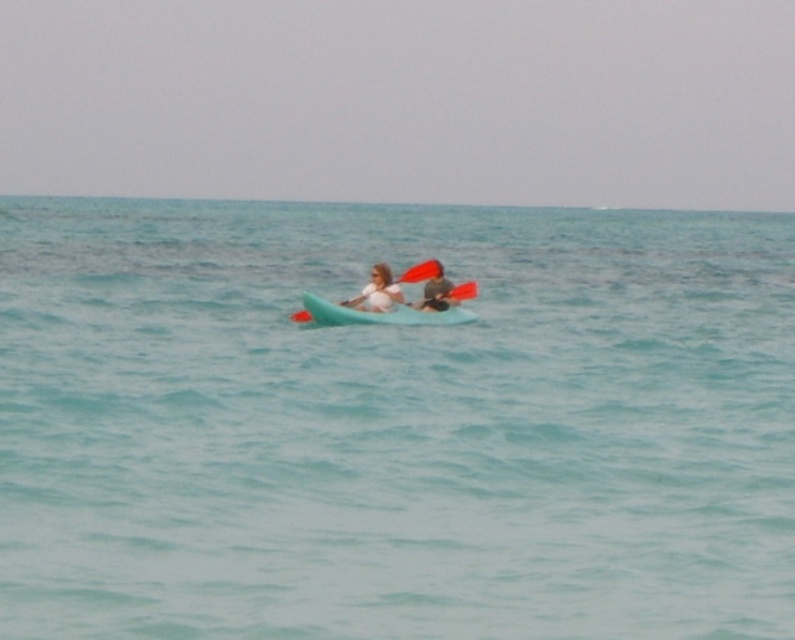
Locate an element on the screen. clear blue water at center is located at coordinates (394, 422).

Between clear blue water at center and rubber paddle at center, which one is positioned lower?

rubber paddle at center is below.

Who is more forward, (704, 413) or (425, 260)?

Positioned in front is point (704, 413).

Locate an element on the screen. clear blue water at center is located at coordinates (394, 422).

Which is behind, point (390, 275) or point (441, 289)?

Positioned behind is point (441, 289).

Who is more forward, (363, 296) or (431, 289)?

Point (363, 296) is in front.

Is point (363, 289) closer to viewer compared to point (440, 308)?

Yes, point (363, 289) is in front of point (440, 308).

Where is `matte white bikini top at center`? The width and height of the screenshot is (795, 640). matte white bikini top at center is located at coordinates (377, 291).

Describe the element at coordinates (377, 291) in the screenshot. I see `matte white bikini top at center` at that location.

Looking at this image, is matte white bikini top at center wider than rubber paddle at center?

Yes.

Between point (363, 308) and point (303, 317), which one is positioned in front?

Point (363, 308)

I want to click on matte white bikini top at center, so click(377, 291).